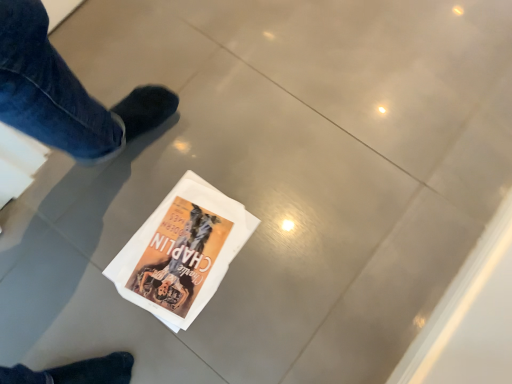
The height and width of the screenshot is (384, 512). Find the location of `free space above white paper at center (from a real-world perspective)`. free space above white paper at center (from a real-world perspective) is located at coordinates (181, 251).